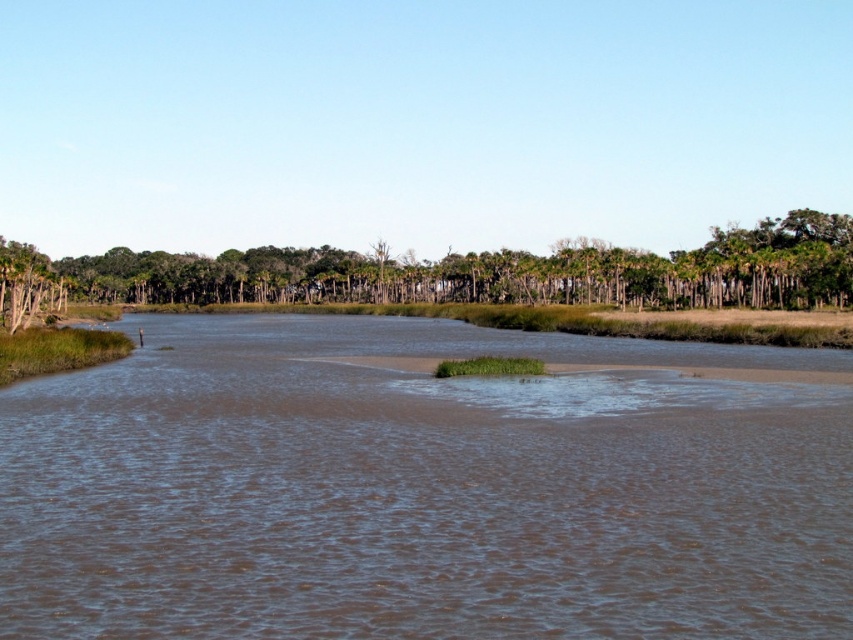
Question: Can you confirm if brown muddy water at center is positioned to the left of green leafy trees at center?

Choices:
 (A) no
 (B) yes

Answer: (A)

Question: Which point appears closest to the camera in this image?

Choices:
 (A) tap(598, 266)
 (B) tap(293, 516)

Answer: (B)

Question: Which object is closer to the camera taking this photo?

Choices:
 (A) brown muddy water at center
 (B) green leafy trees at center

Answer: (A)

Question: Is brown muddy water at center to the right of green leafy trees at center from the viewer's perspective?

Choices:
 (A) yes
 (B) no

Answer: (A)

Question: From the image, what is the correct spatial relationship of brown muddy water at center in relation to green leafy trees at center?

Choices:
 (A) above
 (B) below

Answer: (B)